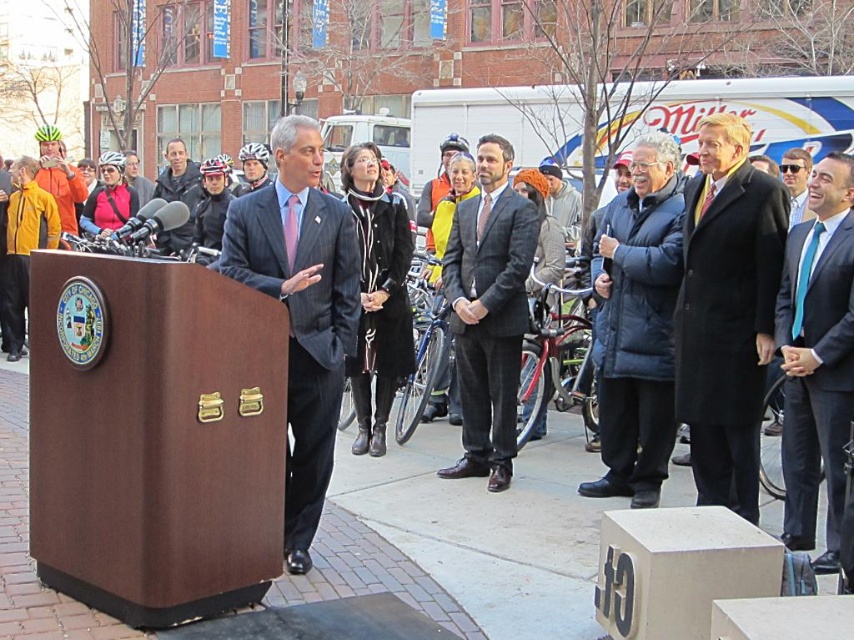
Question: Among these points, which one is nearest to the camera?

Choices:
 (A) (640, 275)
 (B) (787, 499)
 (C) (781, 173)

Answer: (B)

Question: Estimate the real-world distances between objects in this image. Which object is closer to the blue silk tie at right?

Choices:
 (A) blue silk tie at center
 (B) orange jacket at left
 (C) matte black helmet at upper left

Answer: (A)

Question: Which object is positioned closest to the gray wool jacket at center?

Choices:
 (A) matte black helmet at upper left
 (B) black wool coat at right
 (C) gray wool suit at center
 (D) blue silk tie at right

Answer: (C)

Question: Does gray wool suit at center have a greater width compared to orange jacket at left?

Choices:
 (A) no
 (B) yes

Answer: (A)

Question: Does blue silk tie at right have a greater width compared to matte black helmet at upper left?

Choices:
 (A) yes
 (B) no

Answer: (B)

Question: Is black wool coat at right behind orange jacket at left?

Choices:
 (A) no
 (B) yes

Answer: (A)